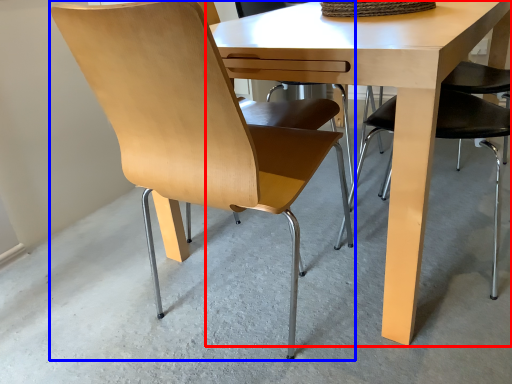
Question: Among these objects, which one is farthest to the camera, table (highlighted by a red box) or chair (highlighted by a blue box)?

Choices:
 (A) table
 (B) chair

Answer: (A)